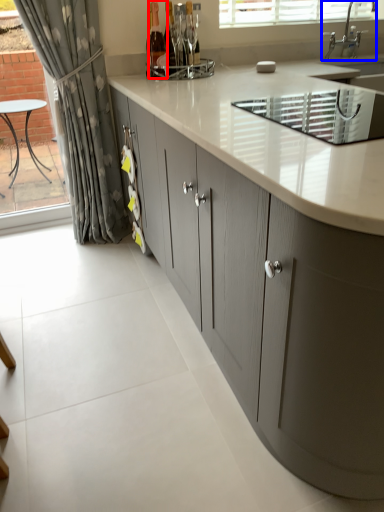
Question: Among these objects, which one is farthest to the camera, bottle (highlighted by a red box) or tap (highlighted by a blue box)?

Choices:
 (A) bottle
 (B) tap

Answer: (B)